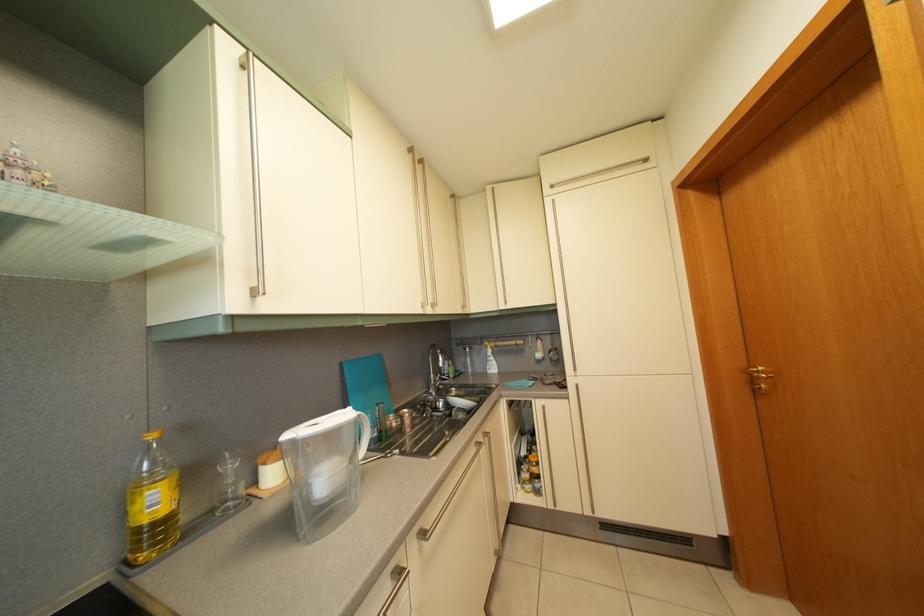
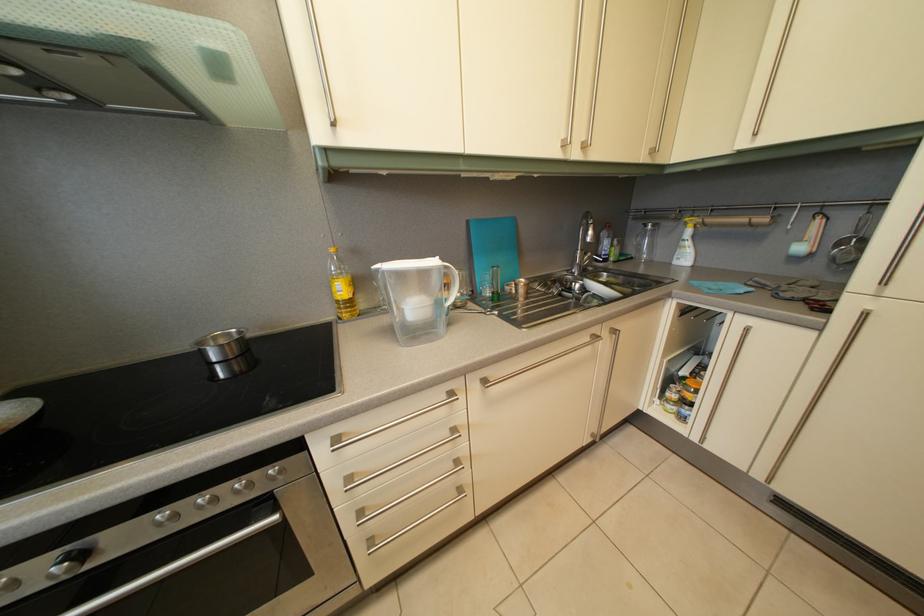
Find the pixel in the second image that matches point 334,485 in the first image.

(421, 315)